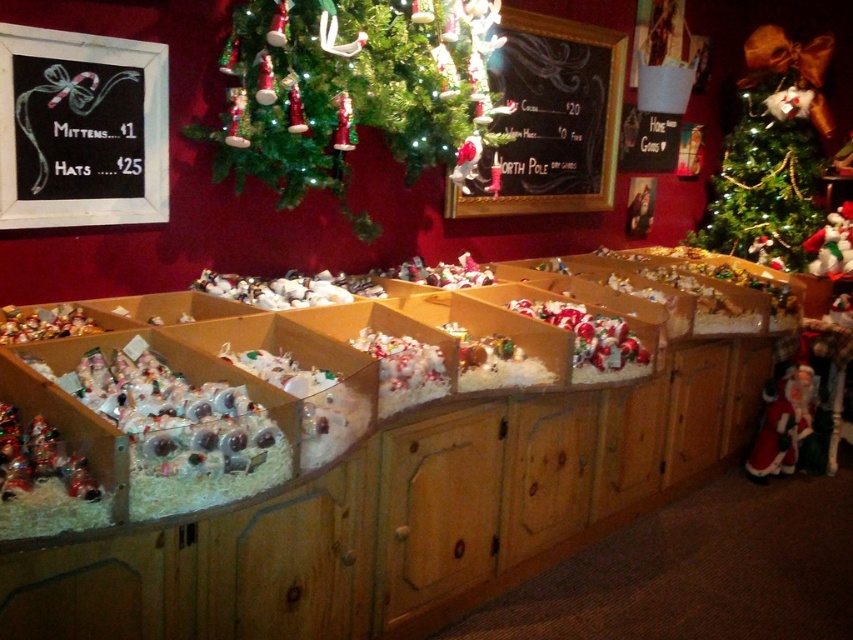
You are a customer standing in front of the festive Christmas display. You want to pick up the white plush santa at right first before reaching for the green textured christmas tree at upper right. Is this possible given their positions?

The green textured christmas tree at upper right is closer to you than the white plush santa at right, so you can reach the white plush santa at right first by moving around the display.

You are a customer in the store and want to buy a small Christmas tree. The store has two options displayed on the wall. Which one should you choose between the green matte christmas tree at upper center and the green textured christmas tree at upper right?

The green textured christmas tree at upper right is smaller than the green matte christmas tree at upper center, so you should choose the green textured christmas tree at upper right for a small option.